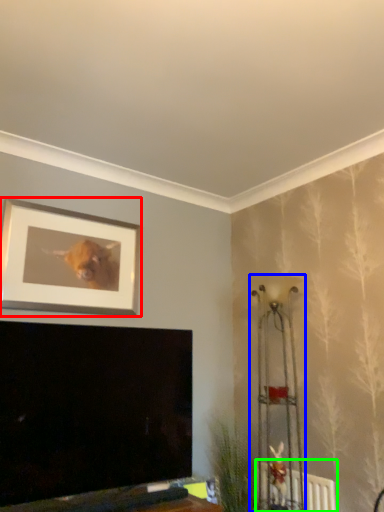
Question: Based on their relative distances, which object is nearer to picture frame (highlighted by a red box)? Choose from lamp (highlighted by a blue box) and radiator (highlighted by a green box).

Choices:
 (A) lamp
 (B) radiator

Answer: (A)